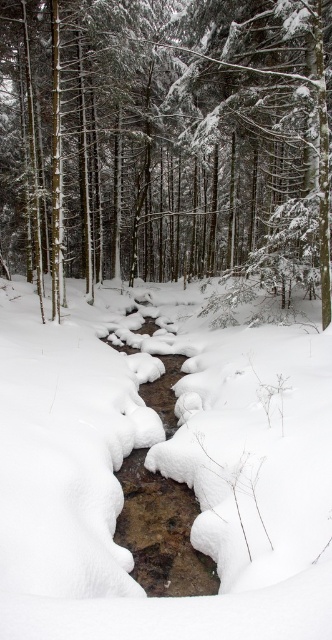
Measure the distance from white fluffy snow at center to snow-covered pine tree at center.

9.11 meters

From the picture: Is white fluffy snow at center below snow-covered pine tree at center?

Yes.

Locate an element on the screen. white fluffy snow at center is located at coordinates (161, 472).

Identify the location of white fluffy snow at center. (161, 472).

Does snow-covered pine tree at center have a lesser width compared to slick ice stream at center?

No, snow-covered pine tree at center is not thinner than slick ice stream at center.

Does point (86, 253) come behind point (185, 566)?

Yes, point (86, 253) is behind point (185, 566).

Image resolution: width=332 pixels, height=640 pixels. What do you see at coordinates (166, 141) in the screenshot?
I see `snow-covered pine tree at center` at bounding box center [166, 141].

I want to click on snow-covered pine tree at center, so click(x=166, y=141).

Which is more to the right, white fluffy snow at center or slick ice stream at center?

Positioned to the right is slick ice stream at center.

Is white fluffy snow at center bigger than slick ice stream at center?

Yes, white fluffy snow at center is bigger than slick ice stream at center.

The height and width of the screenshot is (640, 332). Find the location of `white fluffy snow at center`. white fluffy snow at center is located at coordinates (161, 472).